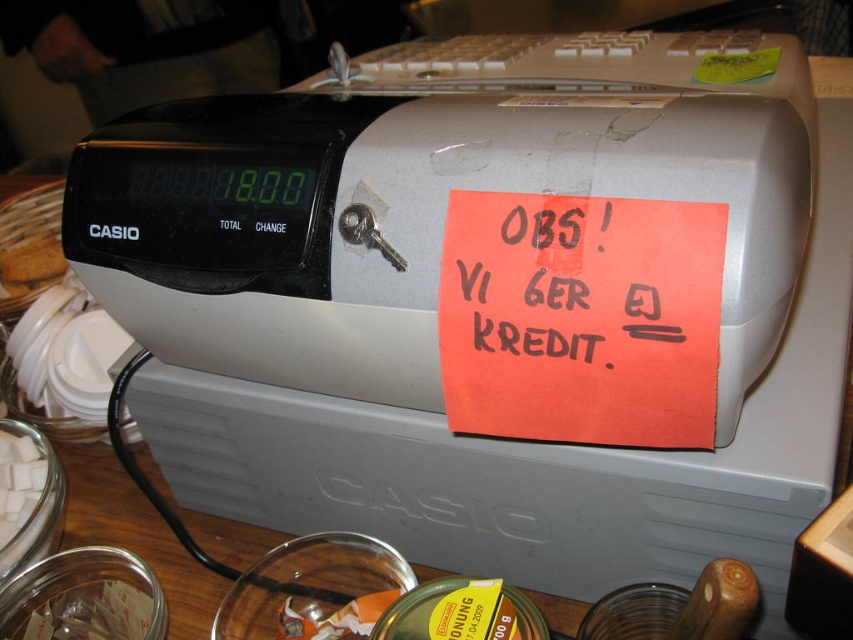
You are a customer looking at the cash register and the orange sticky note. Which of the two points, point (3, 445) or point (735, 61), is closer to you?

Point (3, 445) is closer to you because it is further to the viewer than point (735, 61).

You are a customer at a small shop and see the brown crumbly at left and the yellow paper at top right on the cash register. Which item is located lower on the cash register?

The brown crumbly at left is located lower on the cash register than the yellow paper at top right because it is positioned under it.